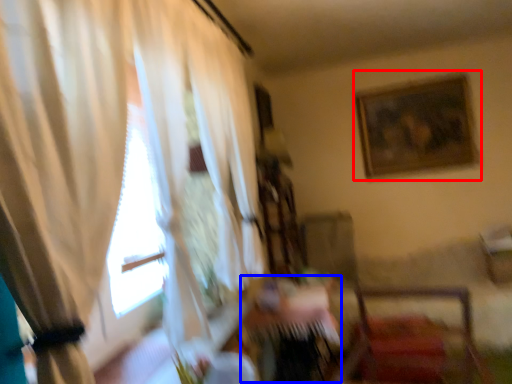
Question: Which object appears closest to the camera in this image, picture frame (highlighted by a red box) or table (highlighted by a blue box)?

Choices:
 (A) picture frame
 (B) table

Answer: (B)